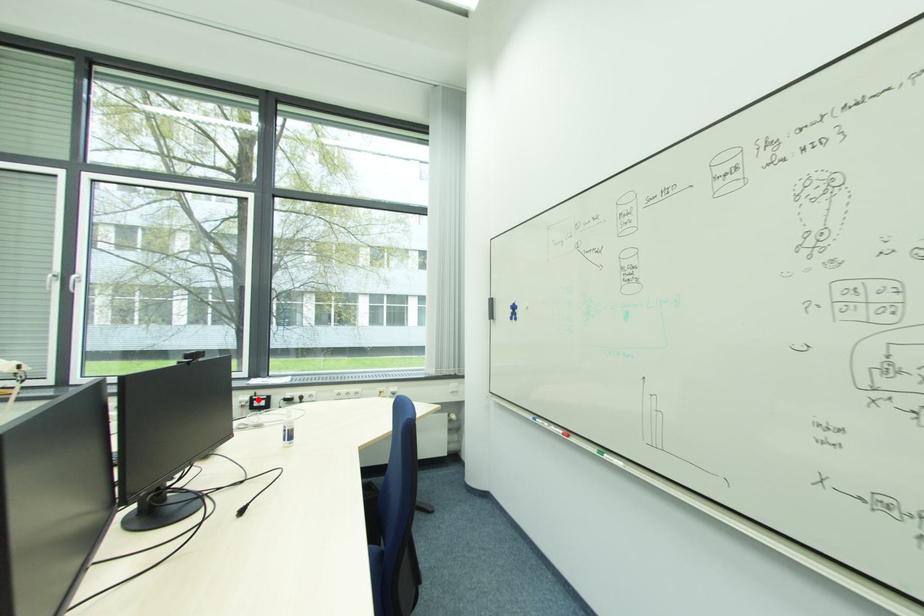
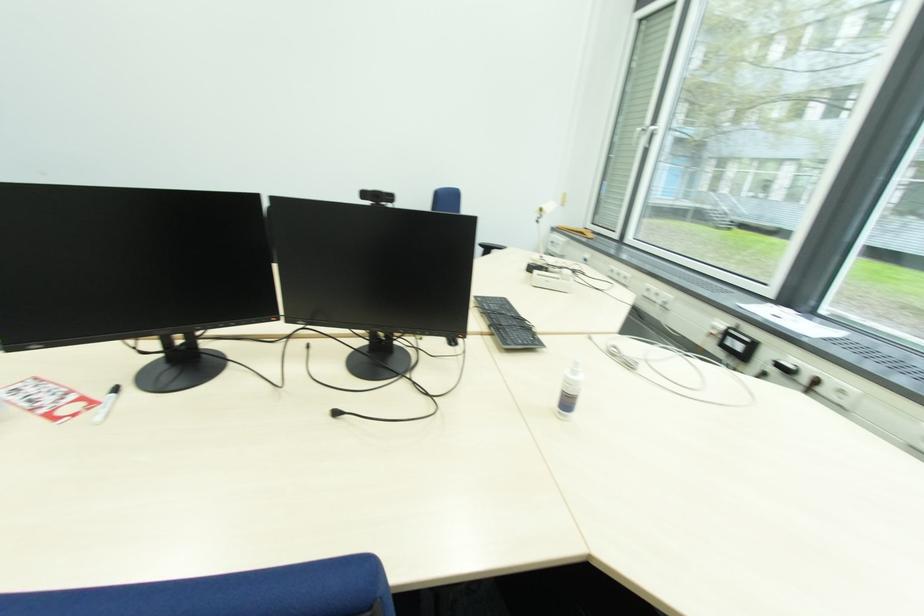
The point at the highlighted location is marked in the first image. Where is the corresponding point in the second image?

(734, 333)